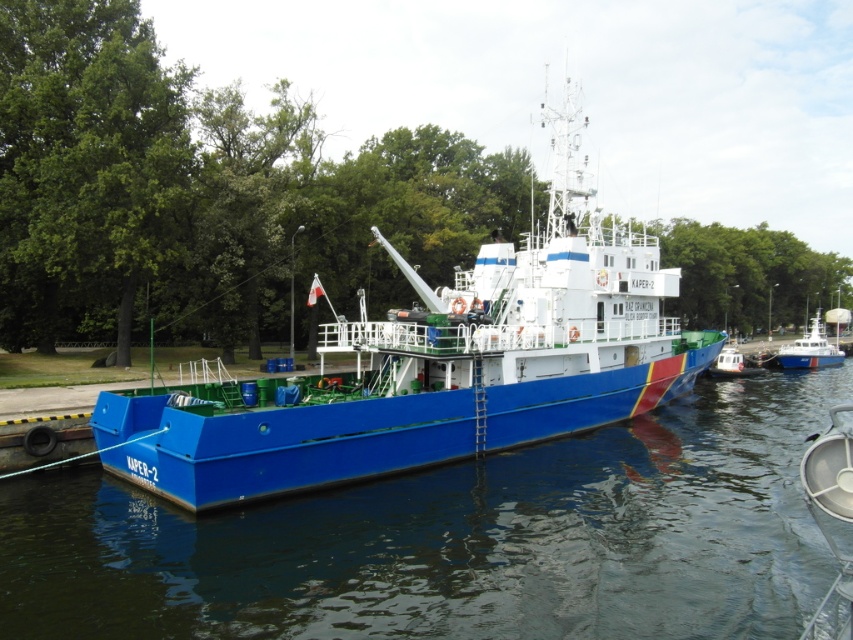
You are a photographer planning to capture the blue glossy water at center and the white glossy boat at center in a single frame. Based on their sizes, which object should you focus on to ensure both are clearly visible in the photo?

The blue glossy water at center is smaller than the white glossy boat at center, so focusing on the white glossy boat at center would allow both objects to be clearly visible in the photo since it takes up more space in the frame.

You are a dock worker who needs to secure both the blue matte boat at center and the white plastic boat at right. Which boat should you approach first if you want to work on the one that is closer to the dock?

The blue matte boat at center is closer to the dock because it is in front of the white plastic boat at right, meaning it is positioned nearer to the dock worker.